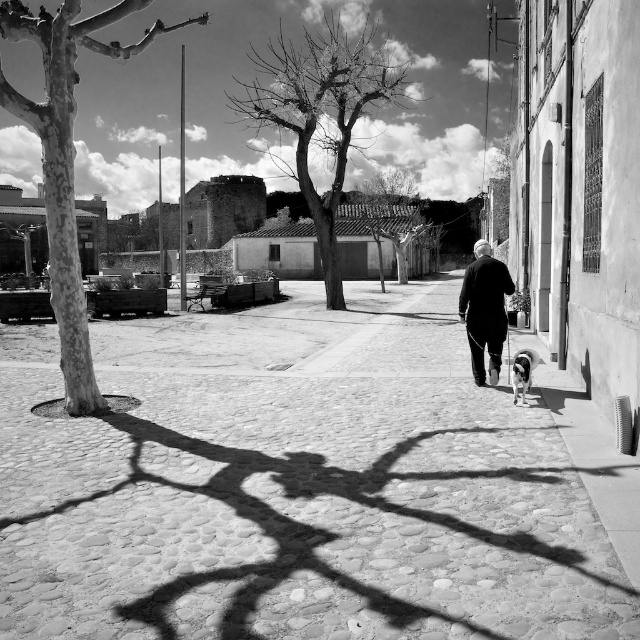
Is smooth bark tree at left thinner than white fur dog at lower right?

No, smooth bark tree at left is not thinner than white fur dog at lower right.

Is smooth bark tree at left further to the viewer compared to white fur dog at lower right?

No.

Describe the element at coordinates (67, 161) in the screenshot. The image size is (640, 640). I see `smooth bark tree at left` at that location.

Find the location of a particular element. The height and width of the screenshot is (640, 640). smooth bark tree at left is located at coordinates (67, 161).

Who is positioned more to the right, smooth bark tree at left or smooth bark tree at center?

smooth bark tree at center

Which is in front, point (58, 134) or point (404, 269)?

Point (58, 134)

Locate an element on the screen. This screenshot has width=640, height=640. smooth bark tree at left is located at coordinates (67, 161).

Can you confirm if bare wood tree at center is taller than smooth bark tree at center?

Yes, bare wood tree at center is taller than smooth bark tree at center.

Does point (346, 88) come behind point (401, 241)?

No, (346, 88) is closer to viewer.

Is point (259, 125) more distant than point (397, 205)?

No, it is not.

In order to click on bare wood tree at center in this screenshot , I will do `click(321, 112)`.